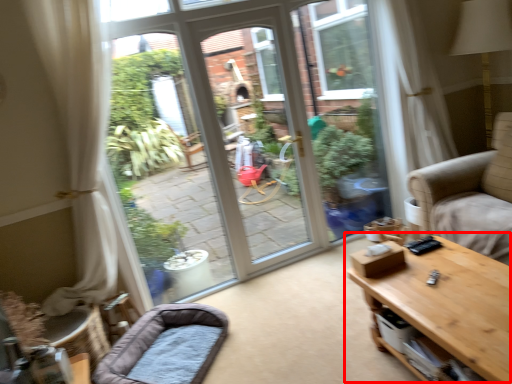
Question: In this image, where is table (annotated by the red box) located relative to dog bed?

Choices:
 (A) right
 (B) left

Answer: (A)